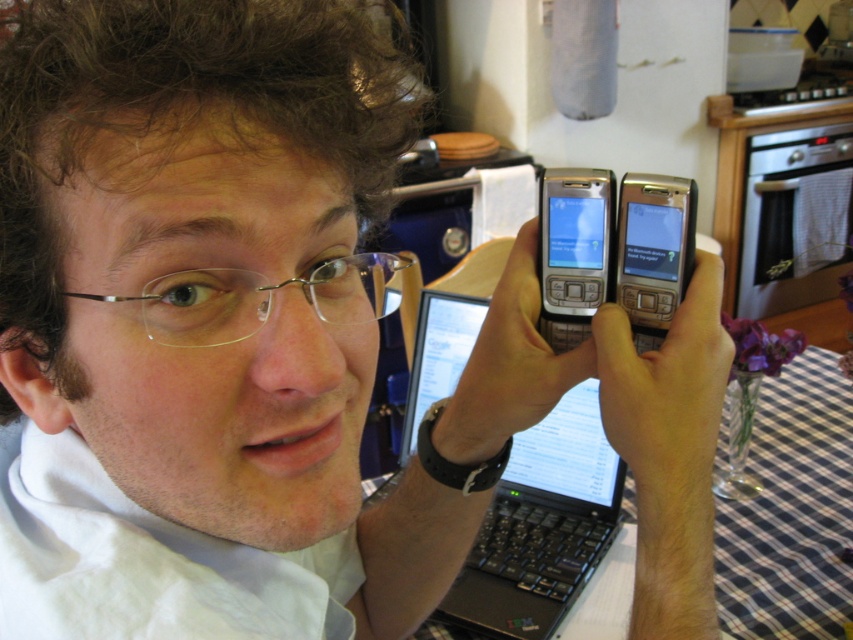
You are standing in front of a kitchen table with a checkered tablecloth. You notice a point marked at coordinates point (610, 288). If you want to place a 50 cm wide object on the table, will it fit from that point to the edge of the table?

The distance of point (610, 288) from viewer is 54.28 centimeters. Since the object is 50 cm wide, it can fit from that point to the edge of the table as there is enough space.

You are a delivery robot that needs to place a small package between the clear plastic glasses at center and the silver metallic phone at upper center. The package is 6.5 inches wide. Will it fit in the space between them?

The distance between the clear plastic glasses at center and the silver metallic phone at upper center is 6.49 inches, so the package which is 6.5 inches wide will not fit as it is slightly wider than the available space.

You are organizing a vintage electronics exhibition and need to display the silver metallic phone at upper center and the silver metallic smartphone at center. Given their sizes, which one requires a larger display area?

The silver metallic smartphone at center requires a larger display area because the silver metallic phone at upper center occupies less space than it.